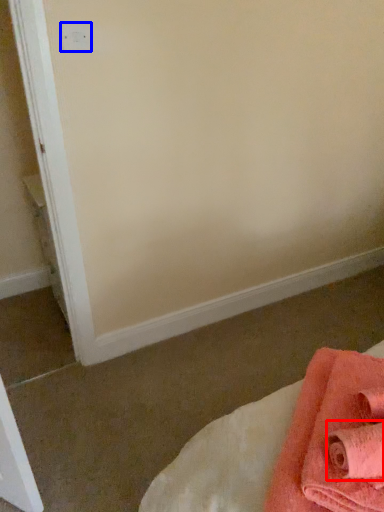
Question: Which object appears farthest to the camera in this image, bath towel (highlighted by a red box) or electric outlet (highlighted by a blue box)?

Choices:
 (A) bath towel
 (B) electric outlet

Answer: (B)